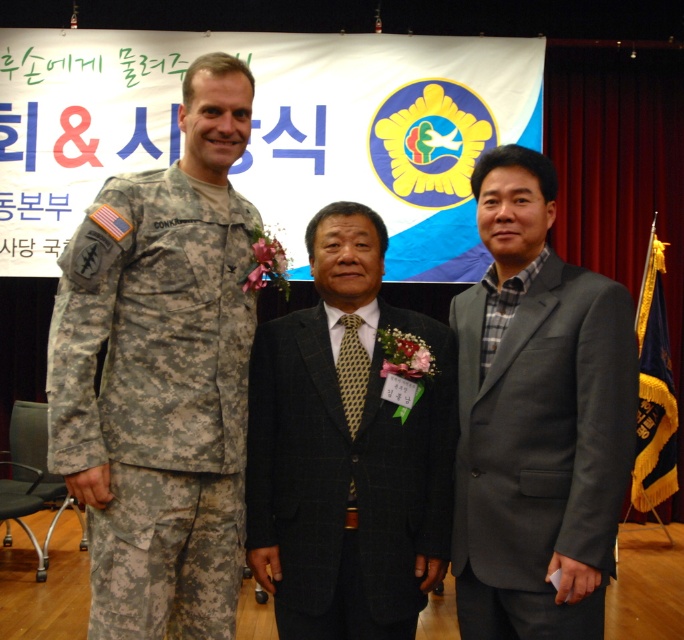
Can you confirm if camouflage uniform at left is positioned to the right of blue velvet flag at right?

No, camouflage uniform at left is not to the right of blue velvet flag at right.

Between camouflage uniform at left and blue velvet flag at right, which one has more height?

Standing taller between the two is blue velvet flag at right.

In order to click on camouflage uniform at left in this screenshot , I will do (x=161, y=376).

Does gray wool suit at center come in front of dark gray textured suit at center?

Yes, it is.

Is gray wool suit at center below dark gray textured suit at center?

No.

Is point (525, 250) more distant than point (447, 449)?

No, (525, 250) is in front of (447, 449).

Locate an element on the screen. The width and height of the screenshot is (684, 640). gray wool suit at center is located at coordinates (536, 419).

Can you confirm if camouflage uniform at left is thinner than dark gray textured suit at center?

Yes.

Which is in front, point (109, 413) or point (256, 344)?

Point (109, 413)

Locate an element on the screen. camouflage uniform at left is located at coordinates (161, 376).